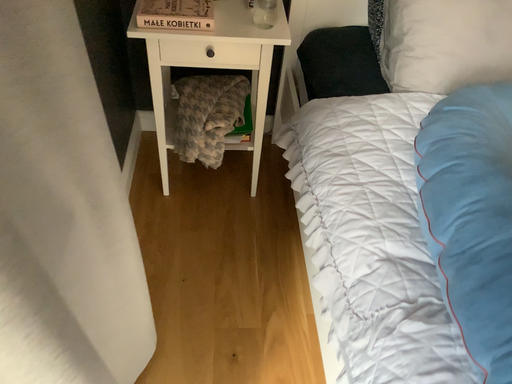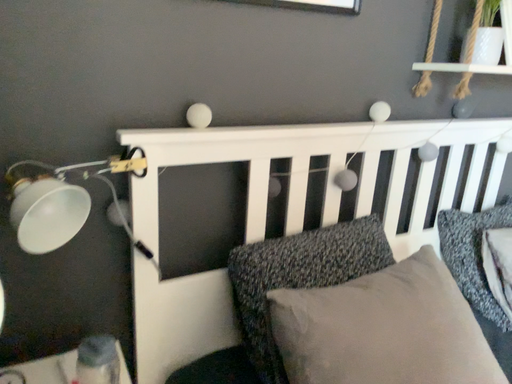
Question: Which way did the camera rotate in the video?

Choices:
 (A) rotated upward
 (B) rotated downward

Answer: (A)